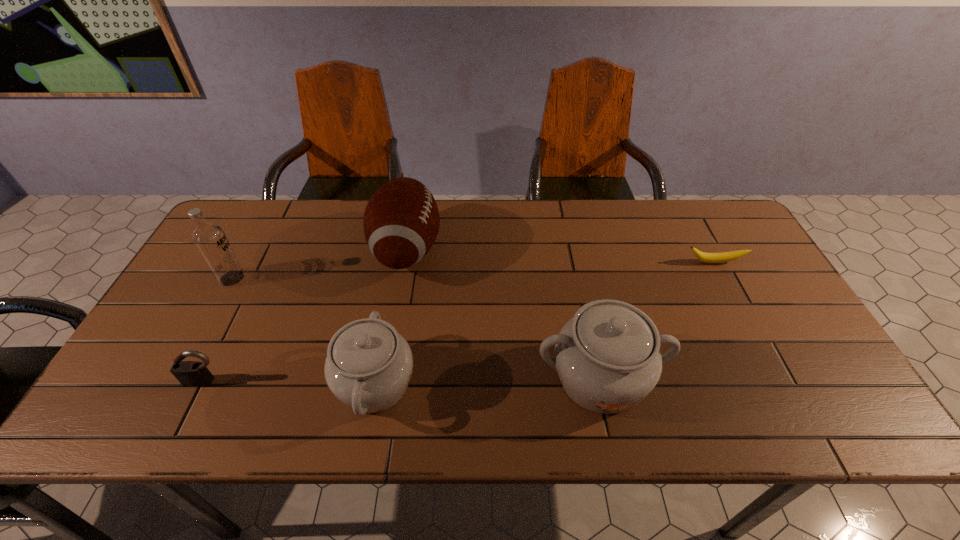
Given the evenly spaced chinawares in the image, where should an extra chinaware be added on the right to preserve the spacing? Please point to a vacant space. Please provide its 2D coordinates. Your answer should be formatted as a tuple, i.e. [(x, y)], where the tuple contains the x and y coordinates of a point satisfying the conditions above.

[(818, 374)]